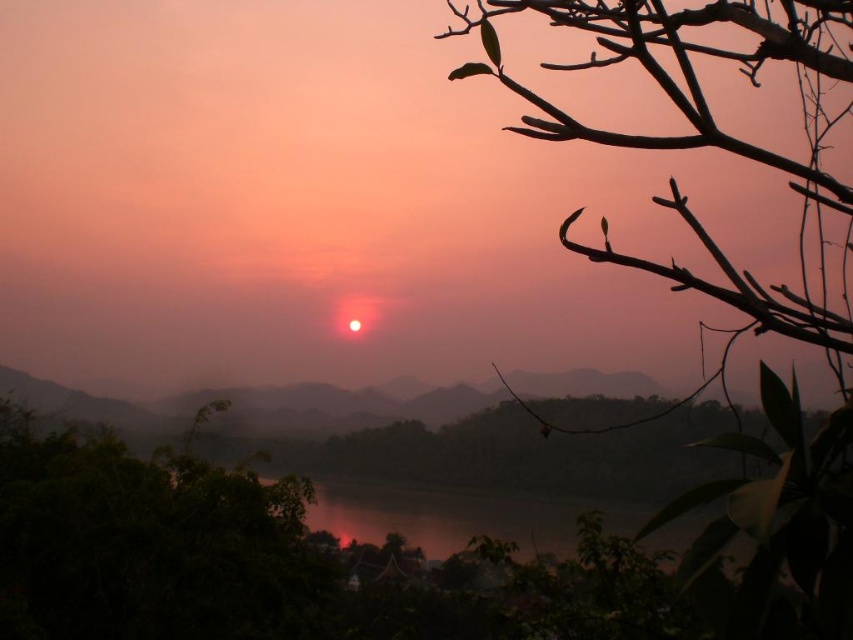
You are standing in the scene and want to walk from the silhouette branch at upper right to the dark reflective water at center. Which direction should you head?

You should head to the left, since the silhouette branch at upper right is to the right of dark reflective water at center.

You are an artist trying to paint the sunset scene. You have two main elements to focus on in your painting. Which element should you allocate more canvas space to, the silhouette branch at upper right or the dark reflective water at center?

The dark reflective water at center should be allocated more canvas space because the silhouette branch at upper right occupies less space than the dark reflective water at center according to the description.